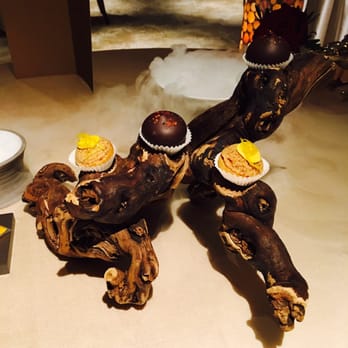
At what (x,y) coordinates should I click in order to perform the action: click on chair leg. Please return your answer as a coordinate pair (x, y). Looking at the image, I should click on (102, 8).